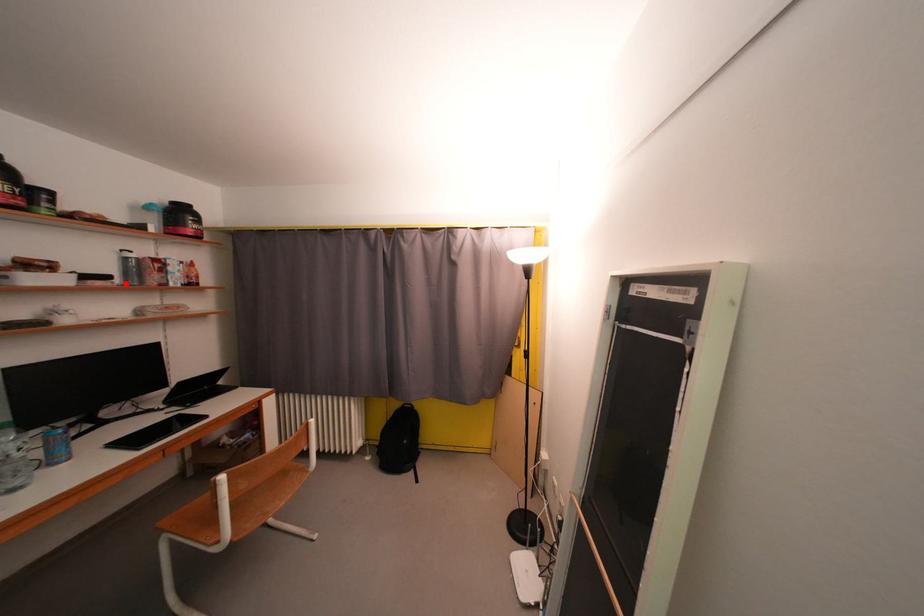
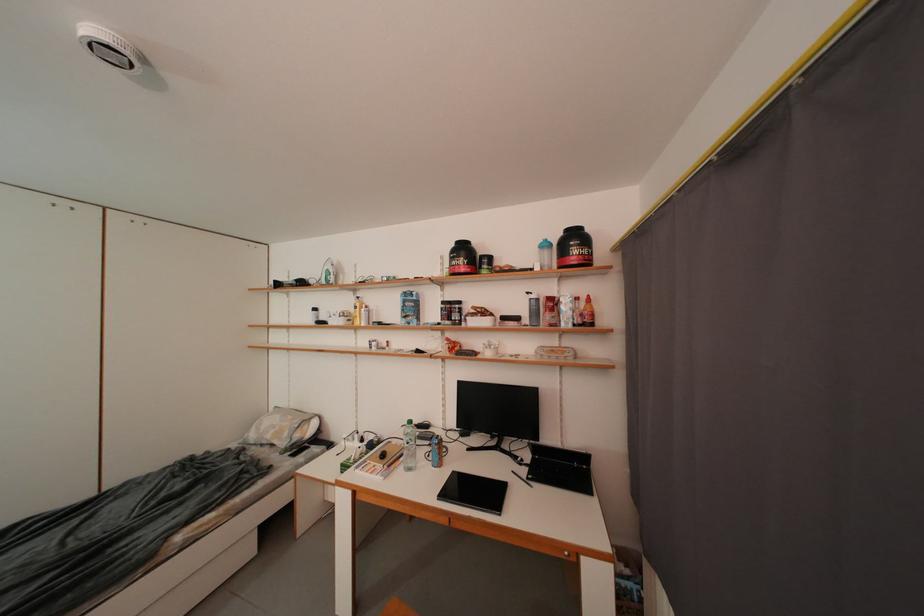
Find the pixel in the second image that matches the highlighted location in the first image.

(533, 323)